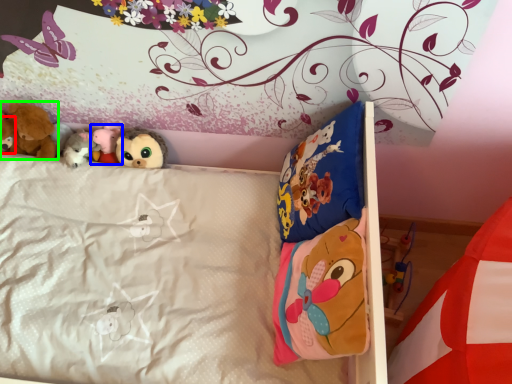
Question: Which object is positioned farthest from toy (highlighted by a red box)? Select from toy (highlighted by a blue box) and toy (highlighted by a green box).

Choices:
 (A) toy
 (B) toy

Answer: (A)